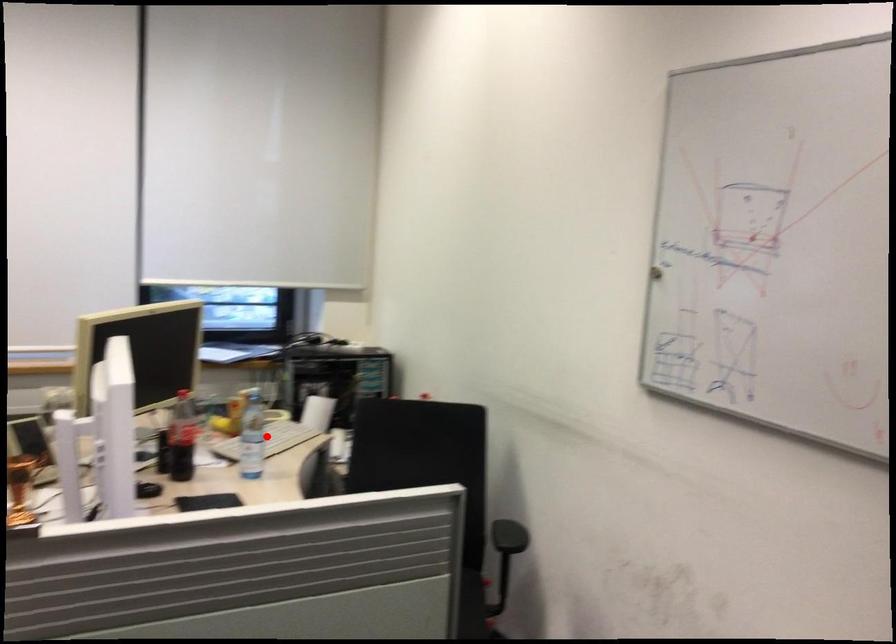
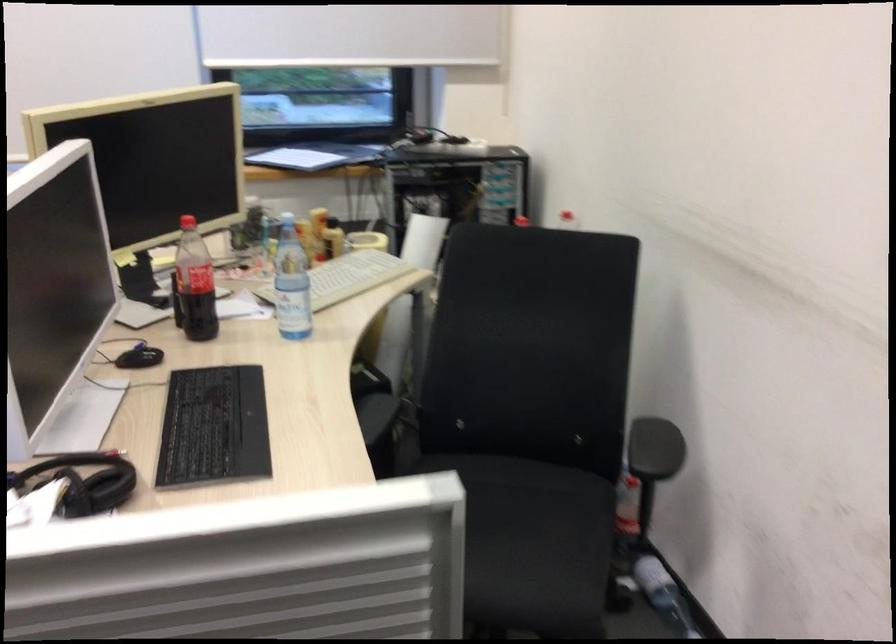
In the second image, find the point that corresponds to the highlighted location in the first image.

(347, 277)